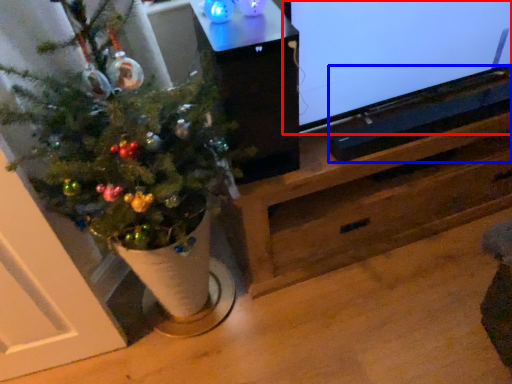
Question: Among these objects, which one is farthest to the camera, television (highlighted by a red box) or wide (highlighted by a blue box)?

Choices:
 (A) television
 (B) wide

Answer: (B)